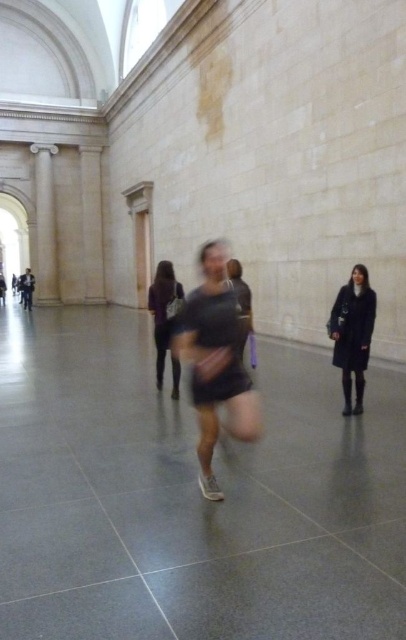
You are standing in the open space and want to walk from the white marble pillar at left to the dark gray fabric dress at center. Which direction should you move relative to the pillar?

You should move towards the center of the space away from the white marble pillar at left to reach the dark gray fabric dress at center, since the pillar is closer to you than the dress.